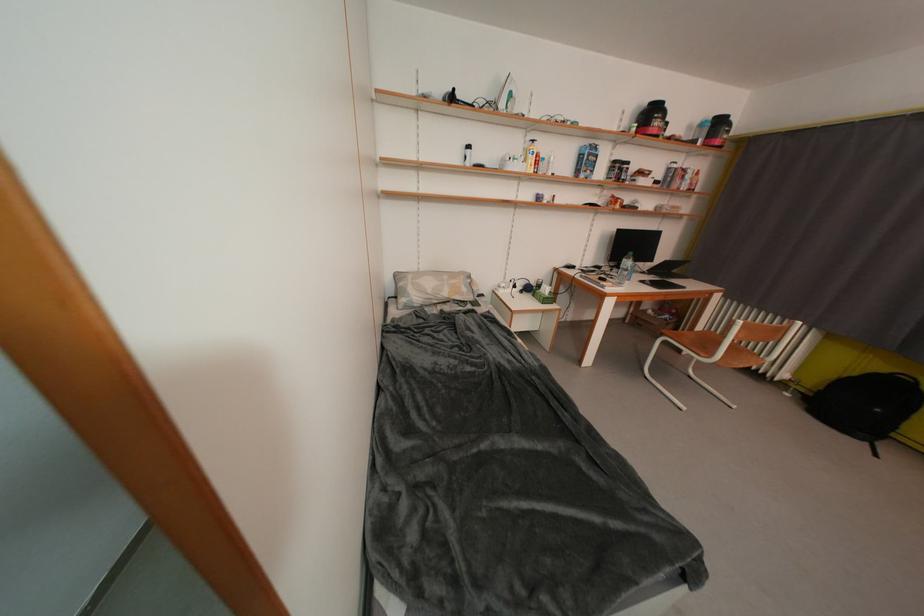
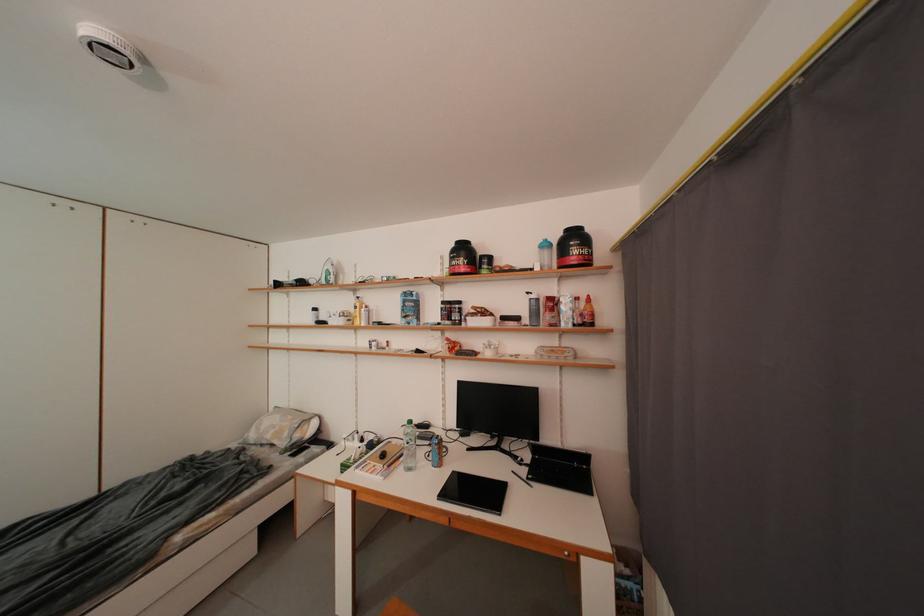
Where in the second image is the point corresponding to (709,128) from the first image?

(553, 249)